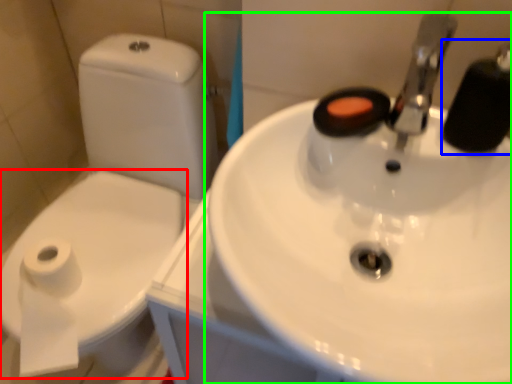
Question: Which is nearer to the bidet (highlighted by a red box)? plumbing fixture (highlighted by a blue box) or sink (highlighted by a green box).

Choices:
 (A) plumbing fixture
 (B) sink

Answer: (B)